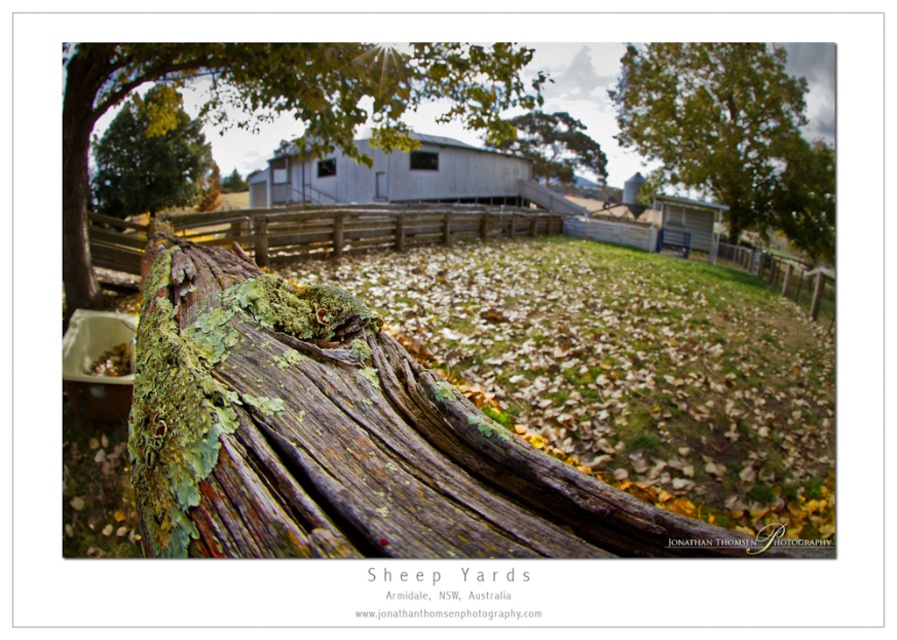
You are a photographer planning to capture a landscape shot of the gray metallic barn at center and the green leafy tree at upper right. Based on their sizes in the image, which object would appear larger in your photo?

The green leafy tree at upper right would appear larger in the photo because it is bigger than the gray metallic barn at center according to the description.

You are a farmer checking the fence in the sheep yard. You notice the weathered wood fence at center and the green mossy wood at upper center. Which object is positioned to the right side of the other?

The weathered wood fence at center is to the left of green mossy wood at upper center, so the green mossy wood at upper center is positioned to the right side of the weathered wood fence at center.